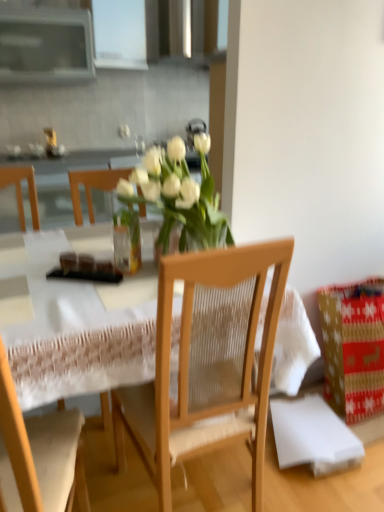
Measure the distance between matte brown bread at table and camera.

They are 4.24 feet apart.

Based on the photo, measure the distance between point [21,451] and camera.

Point [21,451] is 29.96 inches from camera.

Identify the location of wooden chair at center, which appears as the 1th chair when viewed from the left. The width and height of the screenshot is (384, 512). tap(38, 455).

This screenshot has width=384, height=512. Describe the element at coordinates (127, 241) in the screenshot. I see `transparent glass vase at center` at that location.

Identify the location of matte brown bread at table. Image resolution: width=384 pixels, height=512 pixels. (84, 264).

From the image's perspective, which is above, wooden chair at center, positioned as the 2th chair in right-to-left order, or red paper gift at lower right?

red paper gift at lower right is shown above in the image.

Which is in front, wooden chair at center, which appears as the 1th chair when viewed from the left, or red paper gift at lower right?

Positioned in front is wooden chair at center, which appears as the 1th chair when viewed from the left.

Is wooden chair at center, which appears as the 1th chair when viewed from the left, aimed at red paper gift at lower right?

No, wooden chair at center, which appears as the 1th chair when viewed from the left, is not oriented towards red paper gift at lower right.

Where is `cardboard box on the right of wooden chair at center, which appears as the 1th chair when viewed from the left`? cardboard box on the right of wooden chair at center, which appears as the 1th chair when viewed from the left is located at coordinates (353, 348).

Is the surface of wooden chair at center, which appears as the 1th chair when viewed from the left, in direct contact with transparent glass vase at center?

There is a gap between wooden chair at center, which appears as the 1th chair when viewed from the left, and transparent glass vase at center.

How many degrees apart are the facing directions of wooden chair at center, which appears as the 1th chair when viewed from the left, and transparent glass vase at center?

wooden chair at center, which appears as the 1th chair when viewed from the left, and transparent glass vase at center are facing 62.6 degrees away from each other.

From the picture: From the image's perspective, between wooden chair at center, positioned as the 2th chair in right-to-left order, and transparent glass vase at center, who is located below?

wooden chair at center, positioned as the 2th chair in right-to-left order, from the image's perspective.

Is transparent glass vase at center at the back of wooden chair at center, positioned as the 2th chair in right-to-left order?

No, wooden chair at center, positioned as the 2th chair in right-to-left order, is not facing the opposite direction of transparent glass vase at center.

From the image's perspective, is wooden chair at center, placed as the first chair when sorted from right to left, below wooden table at center?

Indeed, from the image's perspective, wooden chair at center, placed as the first chair when sorted from right to left, is shown beneath wooden table at center.

The image size is (384, 512). I want to click on round table above the wooden chair at center, which is the 2th chair in left-to-right order (from the image's perspective), so click(78, 322).

Which is behind, wooden chair at center, which is the 2th chair in left-to-right order, or wooden table at center?

wooden chair at center, which is the 2th chair in left-to-right order, is behind.

Between wooden table at center and matte brown bread at table, which one has less height?

matte brown bread at table.

Between wooden table at center and matte brown bread at table, which one has larger size?

wooden table at center.

Is wooden table at center oriented away from matte brown bread at table?

wooden table at center does not have its back to matte brown bread at table.

Is matte brown bread at table a part of wooden table at center?

Yes, matte brown bread at table is inside wooden table at center.

Can you confirm if red paper gift at lower right is positioned to the left of wooden chair at center, which appears as the 1th chair when viewed from the left?

No, red paper gift at lower right is not to the left of wooden chair at center, which appears as the 1th chair when viewed from the left.

Where is `chair that is the 1st one above the red paper gift at lower right (from a real-world perspective)`? chair that is the 1st one above the red paper gift at lower right (from a real-world perspective) is located at coordinates (38, 455).

Which of these two, red paper gift at lower right or wooden chair at center, positioned as the 2th chair in right-to-left order, stands shorter?

With less height is red paper gift at lower right.

Is red paper gift at lower right bigger than wooden chair at center, which appears as the 1th chair when viewed from the left?

No.

Is matte brown bread at table smaller than transparent glass vase at center?

Yes, matte brown bread at table is smaller than transparent glass vase at center.

Can you tell me how much matte brown bread at table and transparent glass vase at center differ in facing direction?

matte brown bread at table and transparent glass vase at center are facing 175 degrees away from each other.

Consider the image. Can you confirm if matte brown bread at table is taller than transparent glass vase at center?

No, matte brown bread at table is not taller than transparent glass vase at center.

Can you confirm if matte brown bread at table is thinner than transparent glass vase at center?

In fact, matte brown bread at table might be wider than transparent glass vase at center.

Which is less distant, (84, 271) or (141, 429)?

Point (84, 271) is closer to the camera than point (141, 429).

Between matte brown bread at table and wooden chair at center, which is the 2th chair in left-to-right order, which one has smaller size?

With smaller size is matte brown bread at table.

The height and width of the screenshot is (512, 384). Find the location of `cardboard box on the right side of wooden chair at center, positioned as the 2th chair in right-to-left order`. cardboard box on the right side of wooden chair at center, positioned as the 2th chair in right-to-left order is located at coordinates (353, 348).

I want to click on chair on the left side of transparent glass vase at center, so click(x=38, y=455).

From the image, which object appears to be nearer to wooden chair at center, which is the 2th chair in left-to-right order, red paper gift at lower right or matte brown bread at table?

matte brown bread at table lies closer to wooden chair at center, which is the 2th chair in left-to-right order, than the other object.

When comparing their distances from wooden chair at center, positioned as the 2th chair in right-to-left order, does wooden chair at center, placed as the first chair when sorted from right to left, or matte brown bread at table seem further?

Based on the image, matte brown bread at table appears to be further to wooden chair at center, positioned as the 2th chair in right-to-left order.

From the image, which object appears to be farther from wooden chair at center, which is the 2th chair in left-to-right order, red paper gift at lower right or wooden chair at center, which appears as the 1th chair when viewed from the left?

red paper gift at lower right is positioned further to the anchor wooden chair at center, which is the 2th chair in left-to-right order.

Looking at the image, which one is located further to wooden chair at center, placed as the first chair when sorted from right to left, wooden table at center or transparent glass vase at center?

transparent glass vase at center lies further to wooden chair at center, placed as the first chair when sorted from right to left, than the other object.

When comparing their distances from transparent glass vase at center, does wooden table at center or red paper gift at lower right seem further?

red paper gift at lower right.

When comparing their distances from red paper gift at lower right, does wooden table at center or matte brown bread at table seem further?

Based on the image, matte brown bread at table appears to be further to red paper gift at lower right.

Looking at the image, which one is located further to transparent glass vase at center, wooden chair at center, which is the 2th chair in left-to-right order, or matte brown bread at table?

Based on the image, wooden chair at center, which is the 2th chair in left-to-right order, appears to be further to transparent glass vase at center.

Considering their positions, is transparent glass vase at center positioned further to wooden chair at center, positioned as the 2th chair in right-to-left order, than wooden table at center?

transparent glass vase at center.

In order to click on glass vase between wooden chair at center, positioned as the 2th chair in right-to-left order, and matte brown bread at table in the front-back direction in this screenshot , I will do `click(127, 241)`.

The width and height of the screenshot is (384, 512). Identify the location of chair located between wooden chair at center, positioned as the 2th chair in right-to-left order, and matte brown bread at table in the depth direction. (207, 362).

At what (x,y) coordinates should I click in order to perform the action: click on round table between wooden chair at center, which appears as the 1th chair when viewed from the left, and transparent glass vase at center from front to back. Please return your answer as a coordinate pair (x, y). Looking at the image, I should click on (78, 322).

Locate an element on the screen. The width and height of the screenshot is (384, 512). glass vase situated between wooden table at center and red paper gift at lower right from left to right is located at coordinates (127, 241).